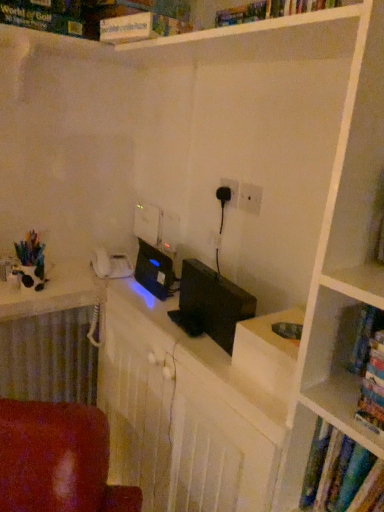
Question: Is white matte puzzle box at upper center oriented away from white plastic electric outlet at center, acting as the first electric outlet starting from the right?

Choices:
 (A) no
 (B) yes

Answer: (A)

Question: Can you see white matte puzzle box at upper center touching white plastic electric outlet at center, acting as the first electric outlet starting from the right?

Choices:
 (A) no
 (B) yes

Answer: (A)

Question: Is white matte puzzle box at upper center shorter than white plastic electric outlet at center, which appears as the 1th electric outlet when viewed from the front?

Choices:
 (A) yes
 (B) no

Answer: (B)

Question: Can you confirm if white matte puzzle box at upper center is taller than white plastic electric outlet at center, the 2th electric outlet viewed from the left?

Choices:
 (A) yes
 (B) no

Answer: (A)

Question: Is white matte puzzle box at upper center further to the viewer compared to white plastic electric outlet at center, which appears as the 1th electric outlet when viewed from the front?

Choices:
 (A) yes
 (B) no

Answer: (B)

Question: In terms of height, does black matte computer monitor at center look taller or shorter compared to black plastic electric outlet at center, positioned as the 1th electric outlet in left-to-right order?

Choices:
 (A) short
 (B) tall

Answer: (B)

Question: Is black matte computer monitor at center wider or thinner than black plastic electric outlet at center, the second electric outlet from the right?

Choices:
 (A) wide
 (B) thin

Answer: (A)

Question: Based on their sizes in the image, would you say black matte computer monitor at center is bigger or smaller than black plastic electric outlet at center, positioned as the 1th electric outlet in left-to-right order?

Choices:
 (A) big
 (B) small

Answer: (A)

Question: From the image's perspective, is black matte computer monitor at center above or below black plastic electric outlet at center, acting as the second electric outlet starting from the front?

Choices:
 (A) below
 (B) above

Answer: (A)

Question: Based on their positions, is black matte computer monitor at center located to the left or right of white matte puzzle box at upper center?

Choices:
 (A) left
 (B) right

Answer: (B)

Question: Considering the positions of point (198, 276) and point (175, 29), is point (198, 276) closer or farther from the camera than point (175, 29)?

Choices:
 (A) farther
 (B) closer

Answer: (A)

Question: In the image, is black matte computer monitor at center positioned in front of or behind white matte puzzle box at upper center?

Choices:
 (A) front
 (B) behind

Answer: (A)

Question: Is black matte computer monitor at center wider or thinner than white matte puzzle box at upper center?

Choices:
 (A) thin
 (B) wide

Answer: (A)

Question: In terms of height, does white matte puzzle box at upper center look taller or shorter compared to multicolored paper book at right, the 2th book from the bottom?

Choices:
 (A) short
 (B) tall

Answer: (A)

Question: From a real-world perspective, is white matte puzzle box at upper center positioned above or below multicolored paper book at right, which is the 1th book in top-to-bottom order?

Choices:
 (A) above
 (B) below

Answer: (A)